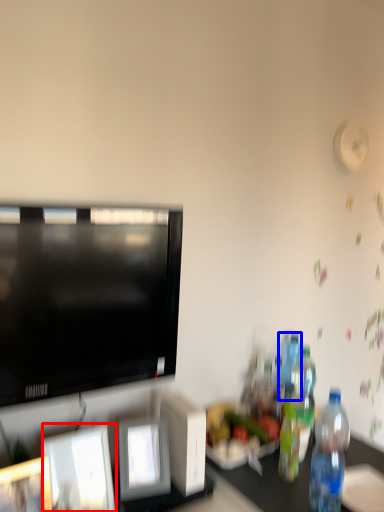
Question: Which point is closer to the camera, picture frame (highlighted by a red box) or bottle (highlighted by a blue box)?

Choices:
 (A) picture frame
 (B) bottle

Answer: (A)